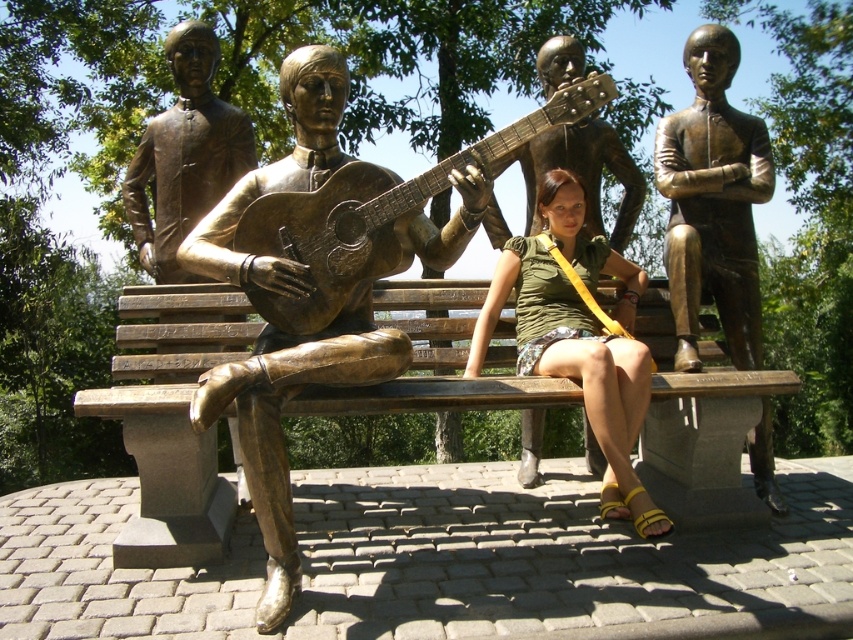
Question: Which point appears closest to the camera in this image?

Choices:
 (A) (412, 243)
 (B) (213, 493)
 (C) (350, 276)

Answer: (C)

Question: Which object is closer to the camera taking this photo?

Choices:
 (A) bronze textured guitar at center
 (B) bronze statue at right

Answer: (A)

Question: Is bronze textured guitar at center further to the viewer compared to bronze statue of man playing guitar at center?

Choices:
 (A) yes
 (B) no

Answer: (B)

Question: Observing the image, what is the correct spatial positioning of bronze statue of guitar at center in reference to bronze textured guitar at center?

Choices:
 (A) below
 (B) above

Answer: (A)

Question: Estimate the real-world distances between objects in this image. Which object is closer to the bronze statue at right?

Choices:
 (A) matte green shirt at center
 (B) bronze statue of man playing guitar at center
 (C) bronze textured guitar at center
 (D) bronze statue of guitar at center

Answer: (A)

Question: Is bronze statue of guitar at center below bronze statue of man playing guitar at center?

Choices:
 (A) no
 (B) yes

Answer: (B)